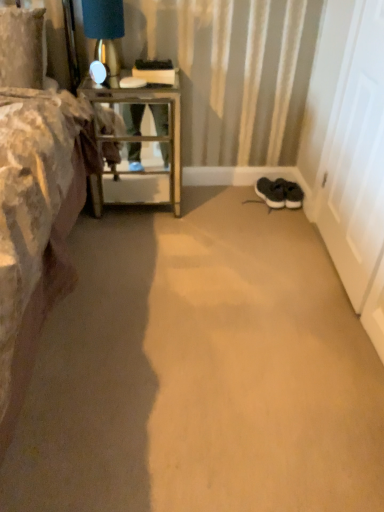
Locate an element on the screen. vacant area in front of white matte door at right is located at coordinates (315, 314).